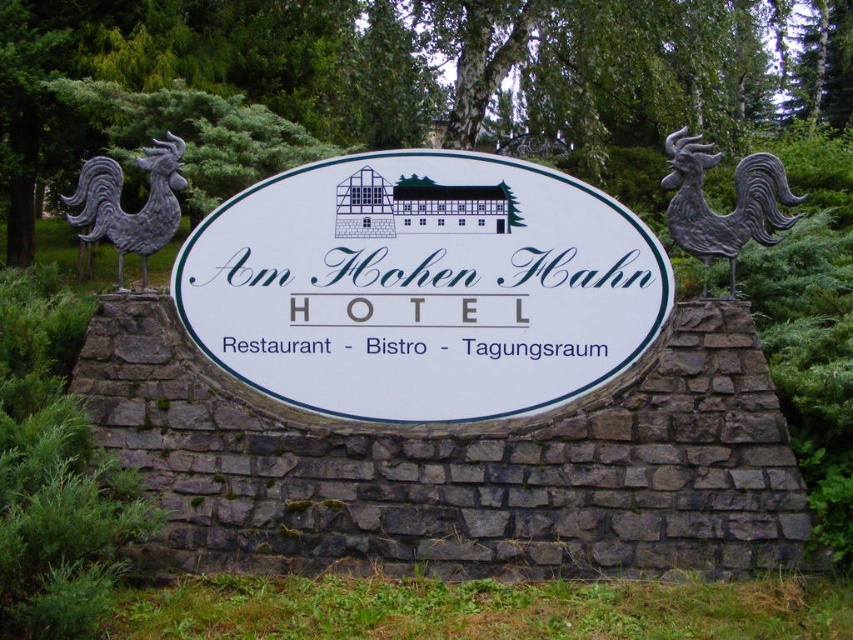
Question: Can you confirm if white paper sign at center is wider than blue plastic sign at center?

Choices:
 (A) yes
 (B) no

Answer: (A)

Question: From the image, what is the correct spatial relationship of white paper sign at center in relation to blue plastic sign at center?

Choices:
 (A) above
 (B) below

Answer: (A)

Question: Which object is farther from the camera taking this photo?

Choices:
 (A) white paper sign at center
 (B) blue plastic text at center
 (C) blue plastic sign at center

Answer: (B)

Question: Which of the following is the closest to the observer?

Choices:
 (A) blue plastic sign at center
 (B) blue plastic text at center
 (C) white paper sign at center

Answer: (C)

Question: Which object appears closest to the camera in this image?

Choices:
 (A) white paper sign at center
 (B) blue plastic text at center

Answer: (A)

Question: Is white paper sign at center bigger than blue plastic sign at center?

Choices:
 (A) no
 (B) yes

Answer: (B)